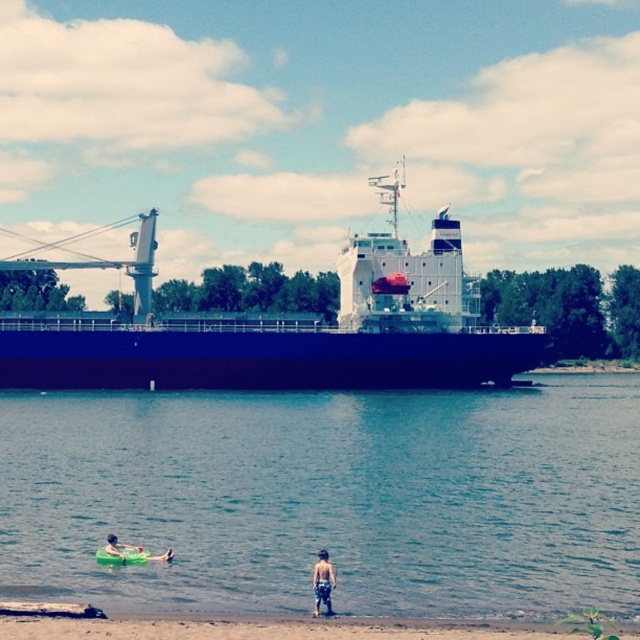
Is clear blue water at lower center to the left of tan skin human at lower center from the viewer's perspective?

Correct, you'll find clear blue water at lower center to the left of tan skin human at lower center.

Does clear blue water at lower center lie behind tan skin human at lower center?

Yes, it is.

Locate an element on the screen. This screenshot has width=640, height=640. clear blue water at lower center is located at coordinates (328, 497).

Is point (244, 333) positioned after point (326, 602)?

Yes, it is behind point (326, 602).

Is the position of blue matte ship at center less distant than that of tan skin human at lower center?

That is False.

Identify the location of blue matte ship at center. (282, 328).

Where is `blue matte ship at center`? Image resolution: width=640 pixels, height=640 pixels. blue matte ship at center is located at coordinates (282, 328).

Does point (234, 317) lie behind point (115, 548)?

That is True.

Can you confirm if blue matte ship at center is thinner than green rubber ring at lower left?

No, blue matte ship at center is not thinner than green rubber ring at lower left.

Is point (394, 243) behind point (132, 550)?

Yes, it is.

Where is `blue matte ship at center`? blue matte ship at center is located at coordinates (282, 328).